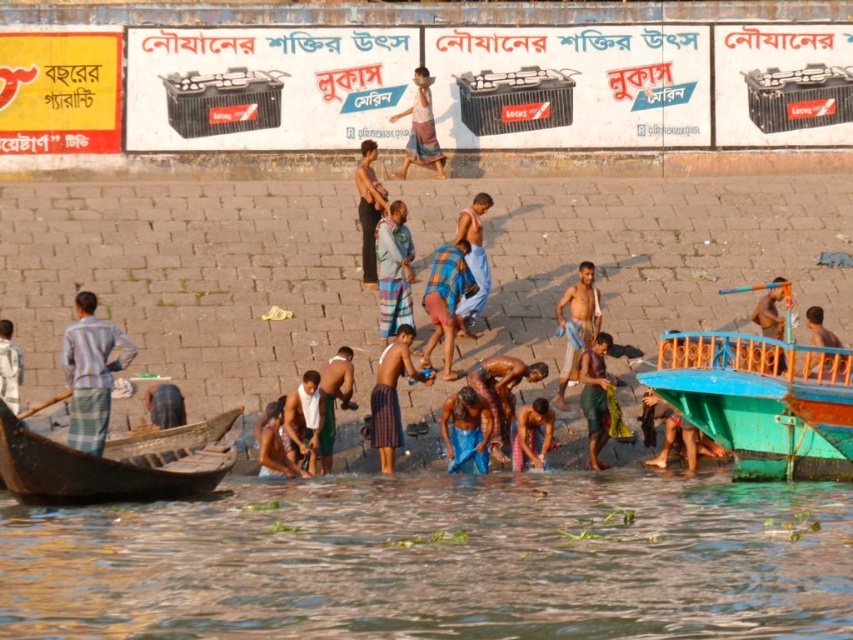
Is brown textured fabric at center closer to camera compared to brown textured cloth at lower center?

No, brown textured fabric at center is further to the viewer.

Who is higher up, brown textured fabric at center or brown textured cloth at lower center?

brown textured fabric at center is above.

Between point (508, 385) and point (285, 476), which one is positioned behind?

The point (508, 385) is behind.

Identify the location of brown textured fabric at center. (502, 394).

Which is below, brown wooden boat at lower left or orange plastic paddle at center?

brown wooden boat at lower left is below.

Looking at this image, does brown wooden boat at lower left appear on the left side of orange plastic paddle at center?

Correct, you'll find brown wooden boat at lower left to the left of orange plastic paddle at center.

Is point (219, 422) positioned after point (784, 282)?

No, it is in front of (784, 282).

What are the coordinates of `brown wooden boat at lower left` in the screenshot? It's located at (114, 464).

Between brown wooden boat at lower left and light brown wooden boat at right, which one has less height?

Standing shorter between the two is light brown wooden boat at right.

Does brown wooden boat at lower left lie behind light brown wooden boat at right?

No, brown wooden boat at lower left is in front of light brown wooden boat at right.

Who is more distant from viewer, [73,470] or [804,371]?

Point [804,371]

The height and width of the screenshot is (640, 853). I want to click on brown wooden boat at lower left, so click(x=114, y=464).